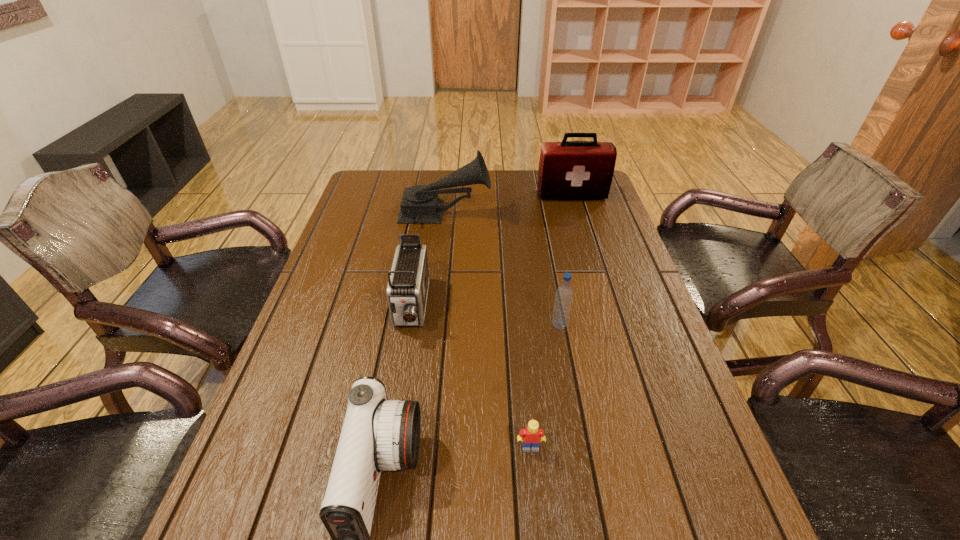
The image size is (960, 540). I want to click on blank space that satisfies the following two spatial constraints: 1. on the side of the first aid kit with the cross symbol; 2. from the horn of the phonograph_record, so coord(577,214).

The image size is (960, 540). Identify the location of vacant region that satisfies the following two spatial constraints: 1. on the side of the first aid kit with the cross symbol; 2. from the horn of the phonograph_record. (577, 214).